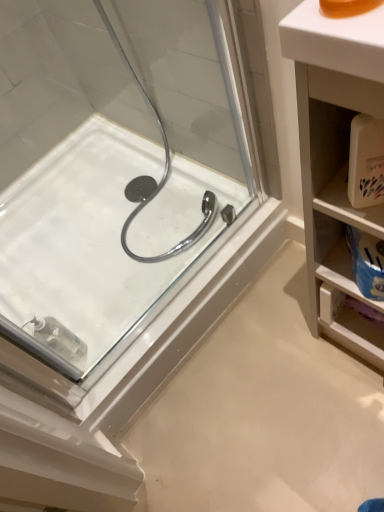
What is the approximate width of white plastic cabinet at right?

The width of white plastic cabinet at right is 11.23 inches.

Locate an element on the screen. Image resolution: width=384 pixels, height=512 pixels. white plastic cabinet at right is located at coordinates (335, 157).

Image resolution: width=384 pixels, height=512 pixels. What do you see at coordinates (335, 157) in the screenshot?
I see `white plastic cabinet at right` at bounding box center [335, 157].

Image resolution: width=384 pixels, height=512 pixels. What do you see at coordinates (96, 243) in the screenshot?
I see `white glossy bath at center` at bounding box center [96, 243].

You are a GUI agent. You are given a task and a screenshot of the screen. Output one action in this format:
    pyautogui.click(x=<x>, y=<y>)
    Task: Click on the white glossy bath at center
    The height and width of the screenshot is (512, 384).
    Given the screenshot: What is the action you would take?
    pyautogui.click(x=96, y=243)

This screenshot has width=384, height=512. I want to click on white plastic cabinet at right, so click(335, 157).

Considering the positions of objects white plastic cabinet at right and white glossy bath at center in the image provided, who is more to the left, white plastic cabinet at right or white glossy bath at center?

From the viewer's perspective, white glossy bath at center appears more on the left side.

Is white plastic cabinet at right positioned in front of white glossy bath at center?

Yes, the depth of white plastic cabinet at right is less than that of white glossy bath at center.

Which point is more distant from viewer, (341, 193) or (73, 302)?

The point (73, 302) is more distant.

From the image's perspective, is white plastic cabinet at right positioned above or below white glossy bath at center?

From the image's perspective, white plastic cabinet at right appears below white glossy bath at center.

From a real-world perspective, which is physically below, white plastic cabinet at right or white glossy bath at center?

From a 3D spatial view, white glossy bath at center is below.

Does white plastic cabinet at right have a lesser width compared to white glossy bath at center?

Yes.

Who is taller, white plastic cabinet at right or white glossy bath at center?

white plastic cabinet at right.

Based on the photo, which of these two, white plastic cabinet at right or white glossy bath at center, is smaller?

Smaller between the two is white plastic cabinet at right.

Does white plastic cabinet at right contain white glossy bath at center?

No, white glossy bath at center is not inside white plastic cabinet at right.

Is white plastic cabinet at right in contact with white glossy bath at center?

No, white plastic cabinet at right is not in contact with white glossy bath at center.

Is white plastic cabinet at right oriented towards white glossy bath at center?

No, white plastic cabinet at right is not aimed at white glossy bath at center.

How many degrees apart are the facing directions of white plastic cabinet at right and white glossy bath at center?

They differ by 89.6 degrees in their facing directions.

You are a GUI agent. You are given a task and a screenshot of the screen. Output one action in this format:
    pyautogui.click(x=<x>, y=<y>)
    Task: Click on the bathroom cabinet in front of the white glossy bath at center
    
    Given the screenshot: What is the action you would take?
    pyautogui.click(x=335, y=157)

Does white glossy bath at center appear on the left side of white plastic cabinet at right?

Correct, you'll find white glossy bath at center to the left of white plastic cabinet at right.

Is white glossy bath at center in front of or behind white plastic cabinet at right in the image?

Clearly, white glossy bath at center is behind white plastic cabinet at right.

Which is closer to the camera, (4,248) or (304,220)?

Point (4,248).

From the image's perspective, which one is positioned higher, white glossy bath at center or white plastic cabinet at right?

white glossy bath at center appears higher in the image.

From a real-world perspective, is white glossy bath at center above or below white plastic cabinet at right?

In terms of real-world spatial position, white glossy bath at center is below white plastic cabinet at right.

Can you confirm if white glossy bath at center is wider than white plastic cabinet at right?

Yes, white glossy bath at center is wider than white plastic cabinet at right.

Considering the sizes of objects white glossy bath at center and white plastic cabinet at right in the image provided, who is taller, white glossy bath at center or white plastic cabinet at right?

white plastic cabinet at right is taller.

Consider the image. Is white glossy bath at center bigger than white plastic cabinet at right?

Yes, white glossy bath at center is bigger than white plastic cabinet at right.

Is white glossy bath at center inside the boundaries of white plastic cabinet at right, or outside?

white glossy bath at center is not inside white plastic cabinet at right, it's outside.

Are white glossy bath at center and white plastic cabinet at right located far from each other?

Actually, white glossy bath at center and white plastic cabinet at right are a little close together.

Is white glossy bath at center oriented towards white plastic cabinet at right?

No, white glossy bath at center is not aimed at white plastic cabinet at right.

From the picture: How many degrees apart are the facing directions of white glossy bath at center and white plastic cabinet at right?

The facing directions of white glossy bath at center and white plastic cabinet at right are 89.6 degrees apart.

You are a GUI agent. You are given a task and a screenshot of the screen. Output one action in this format:
    pyautogui.click(x=<x>, y=<y>)
    Task: Click on the bath behind the white plastic cabinet at right
    The image size is (384, 512).
    Given the screenshot: What is the action you would take?
    pyautogui.click(x=96, y=243)

This screenshot has width=384, height=512. I want to click on bath behind the white plastic cabinet at right, so click(96, 243).

Where is `bathroom cabinet above the white glossy bath at center (from a real-world perspective)`? bathroom cabinet above the white glossy bath at center (from a real-world perspective) is located at coordinates (335, 157).